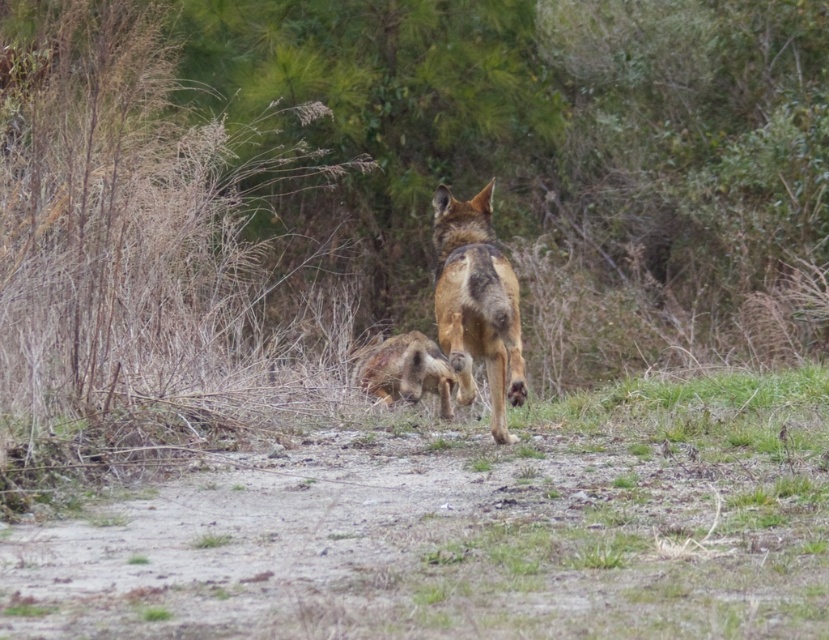
Question: Can you confirm if brown fur dog at center is wider than furry brown animal at center?

Choices:
 (A) yes
 (B) no

Answer: (B)

Question: Considering the real-world distances, which object is farthest from the brown dirt field at center?

Choices:
 (A) furry brown animal at center
 (B) brown fur dog at center

Answer: (A)

Question: Is brown dirt field at center behind furry brown animal at center?

Choices:
 (A) no
 (B) yes

Answer: (A)

Question: Which of the following is the farthest from the observer?

Choices:
 (A) (425, 381)
 (B) (784, 428)

Answer: (A)

Question: Which point is closer to the camera?

Choices:
 (A) brown dirt field at center
 (B) brown fur dog at center

Answer: (A)

Question: Is brown dirt field at center wider than furry brown animal at center?

Choices:
 (A) yes
 (B) no

Answer: (A)